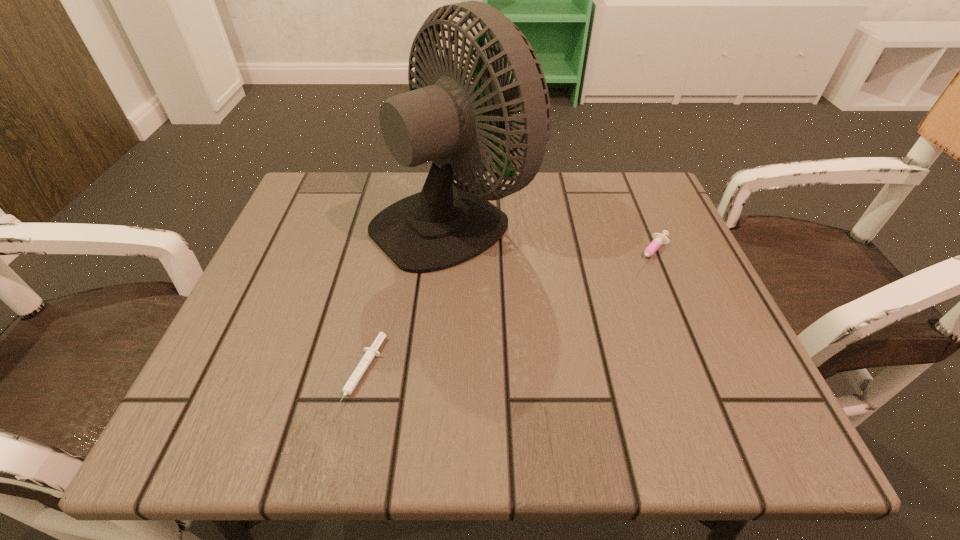
Image resolution: width=960 pixels, height=540 pixels. I want to click on free point that satisfies the following two spatial constraints: 1. on the back side of the rightmost object; 2. on the right side of the shortest object, so click(x=389, y=253).

Find the location of `blank space that satisfies the following two spatial constraints: 1. in front of the fan to direct airflow; 2. on the front side of the left syringe`. blank space that satisfies the following two spatial constraints: 1. in front of the fan to direct airflow; 2. on the front side of the left syringe is located at coordinates (444, 375).

The image size is (960, 540). I want to click on vacant space that satisfies the following two spatial constraints: 1. in front of the farther syringe to direct airflow; 2. on the left side of the tallest object, so click(451, 253).

Where is `free space that satisfies the following two spatial constraints: 1. in front of the tallest object to direct airflow; 2. on the left side of the right syringe`? The width and height of the screenshot is (960, 540). free space that satisfies the following two spatial constraints: 1. in front of the tallest object to direct airflow; 2. on the left side of the right syringe is located at coordinates (451, 253).

At what (x,y) coordinates should I click in order to perform the action: click on vacant space that satisfies the following two spatial constraints: 1. in front of the farther syringe to direct airflow; 2. on the left side of the tallest object. Please return your answer as a coordinate pair (x, y). The width and height of the screenshot is (960, 540). Looking at the image, I should click on (451, 253).

At what (x,y) coordinates should I click in order to perform the action: click on vacant space that satisfies the following two spatial constraints: 1. on the back side of the taller syringe; 2. in front of the fan to direct airflow. Please return your answer as a coordinate pair (x, y). Image resolution: width=960 pixels, height=540 pixels. Looking at the image, I should click on (636, 217).